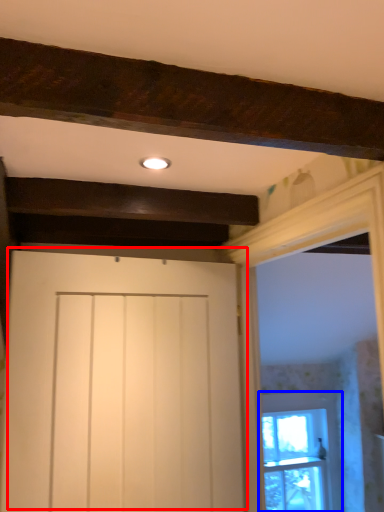
Question: Which point is closer to the camera, door (highlighted by a red box) or window (highlighted by a blue box)?

Choices:
 (A) door
 (B) window

Answer: (A)